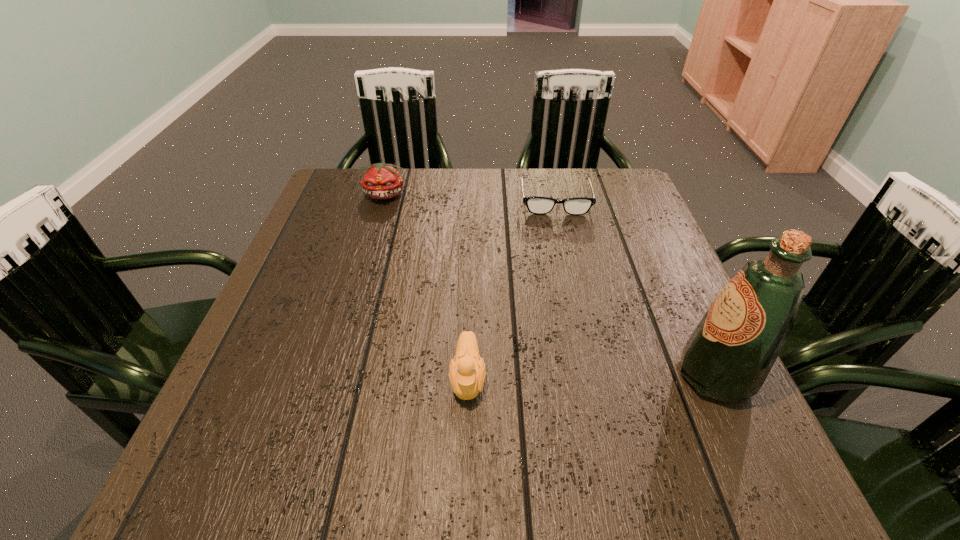
Find the location of `vacant space on the desktop that is between the duckling and the rightmost object and is positioned on the front-facing side of the shortest object`. vacant space on the desktop that is between the duckling and the rightmost object and is positioned on the front-facing side of the shortest object is located at coordinates 584,377.

Locate an element on the screen. free space on the desktop that is between the duckling and the tallest object and is positioned on the front-facing side of the leftmost object is located at coordinates (560, 377).